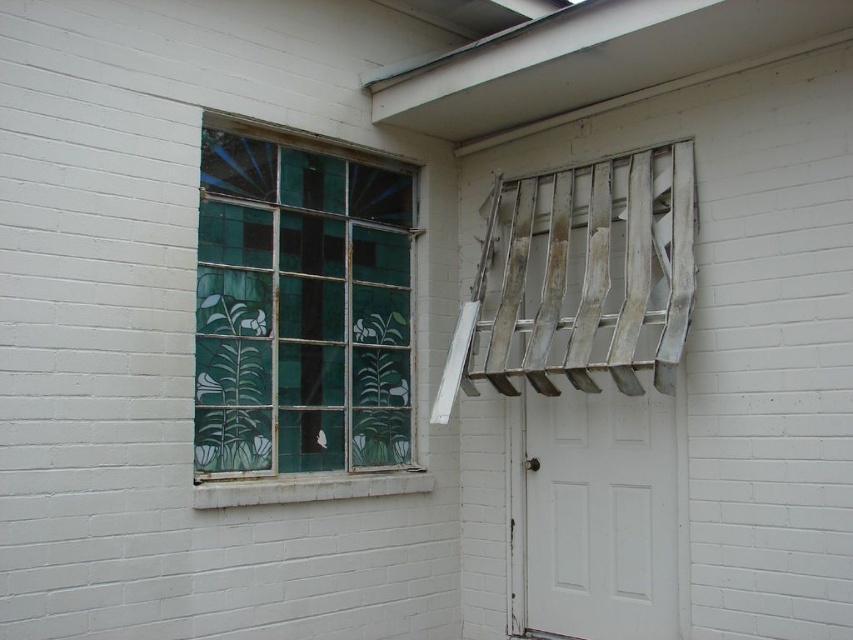
Who is positioned more to the left, green stained glass window at left or white matte door at center?

Positioned to the left is green stained glass window at left.

Which of these two, green stained glass window at left or white matte door at center, stands shorter?

white matte door at center is shorter.

Identify the location of green stained glass window at left. The image size is (853, 640). (300, 320).